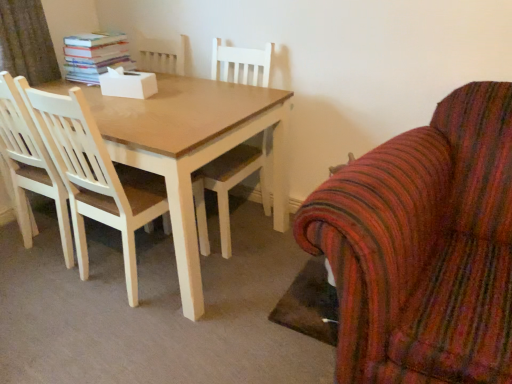
Question: Does striped fabric armchair at right, marked as the 1th chair in a right-to-left arrangement, have a smaller size compared to hardcover books at upper left?

Choices:
 (A) yes
 (B) no

Answer: (B)

Question: From the image's perspective, does striped fabric armchair at right, the second chair when ordered from left to right, appear lower than hardcover books at upper left?

Choices:
 (A) yes
 (B) no

Answer: (A)

Question: Does striped fabric armchair at right, the second chair when ordered from left to right, appear on the left side of hardcover books at upper left?

Choices:
 (A) yes
 (B) no

Answer: (B)

Question: Is hardcover books at upper left at the back of striped fabric armchair at right, the second chair when ordered from left to right?

Choices:
 (A) no
 (B) yes

Answer: (A)

Question: Would you say striped fabric armchair at right, the second chair when ordered from left to right, contains hardcover books at upper left?

Choices:
 (A) yes
 (B) no

Answer: (B)

Question: From the image's perspective, is striped fabric armchair at right, the second chair when ordered from left to right, on top of hardcover books at upper left?

Choices:
 (A) no
 (B) yes

Answer: (A)

Question: Considering the relative sizes of striped fabric armchair at right, the second chair when ordered from left to right, and light wood chair at left, positioned as the 1th chair in left-to-right order, in the image provided, is striped fabric armchair at right, the second chair when ordered from left to right, bigger than light wood chair at left, positioned as the 1th chair in left-to-right order,?

Choices:
 (A) yes
 (B) no

Answer: (A)

Question: Is the depth of striped fabric armchair at right, marked as the 1th chair in a right-to-left arrangement, less than that of light wood chair at left, which is the 2th chair from right to left?

Choices:
 (A) yes
 (B) no

Answer: (A)

Question: From the image's perspective, would you say striped fabric armchair at right, marked as the 1th chair in a right-to-left arrangement, is shown under light wood chair at left, which is the 2th chair from right to left?

Choices:
 (A) yes
 (B) no

Answer: (A)

Question: Is striped fabric armchair at right, the second chair when ordered from left to right, far away from light wood chair at left, positioned as the 1th chair in left-to-right order?

Choices:
 (A) no
 (B) yes

Answer: (A)

Question: From a real-world perspective, is striped fabric armchair at right, marked as the 1th chair in a right-to-left arrangement, positioned under light wood chair at left, positioned as the 1th chair in left-to-right order, based on gravity?

Choices:
 (A) no
 (B) yes

Answer: (B)

Question: Considering the relative positions of striped fabric armchair at right, marked as the 1th chair in a right-to-left arrangement, and light wood chair at left, which is the 2th chair from right to left, in the image provided, is striped fabric armchair at right, marked as the 1th chair in a right-to-left arrangement, behind light wood chair at left, which is the 2th chair from right to left,?

Choices:
 (A) yes
 (B) no

Answer: (B)

Question: Can you confirm if light wood chair at left, which is the 2th chair from right to left, is thinner than striped fabric armchair at right, the second chair when ordered from left to right?

Choices:
 (A) no
 (B) yes

Answer: (B)